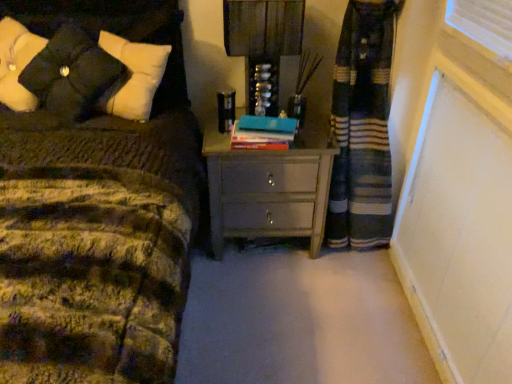
This screenshot has width=512, height=384. I want to click on hardcover book at center, so click(x=263, y=133).

Measure the distance between hardcover book at center and camera.

hardcover book at center is 1.51 meters from camera.

What do you see at coordinates (266, 43) in the screenshot? I see `matte black lampshade at upper center` at bounding box center [266, 43].

In order to face matte black lampshade at upper center, should I rotate leftwards or rightwards?

You should rotate right by 0.998 degrees.

Locate an element on the screen. This screenshot has height=384, width=512. black matte pillow at upper left is located at coordinates (71, 74).

Identify the location of matte gray chest of drawers at center. (269, 187).

Find the location of a particular element. Image resolution: width=512 pixels, height=384 pixels. hardcover book at center is located at coordinates (263, 133).

Between black matte pillow at upper left and matte gray chest of drawers at center, which one has larger width?

matte gray chest of drawers at center is wider.

Find the location of `chest of drawers below the black matte pillow at upper left (from a real-world perspective)`. chest of drawers below the black matte pillow at upper left (from a real-world perspective) is located at coordinates (269, 187).

Is black matte pillow at upper left not close to matte gray chest of drawers at center?

black matte pillow at upper left is near matte gray chest of drawers at center, not far away.

Can matte gray chest of drawers at center be found inside black matte pillow at upper left?

No.

Which object is wider, hardcover book at center or black matte pillow at upper left?

With larger width is black matte pillow at upper left.

The image size is (512, 384). I want to click on pillow that is above the hardcover book at center (from the image's perspective), so click(71, 74).

Between hardcover book at center and black matte pillow at upper left, which one has more height?

Standing taller between the two is black matte pillow at upper left.

From a real-world perspective, does hardcover book at center stand above black matte pillow at upper left?

No.

The height and width of the screenshot is (384, 512). Identify the location of chest of drawers behind the black matte pillow at upper left. tap(269, 187).

Is black matte pillow at upper left surrounded by matte gray chest of drawers at center?

That's incorrect, black matte pillow at upper left is not inside matte gray chest of drawers at center.

How many degrees apart are the facing directions of matte gray chest of drawers at center and black matte pillow at upper left?

There is a 6.2-degree angle between the facing directions of matte gray chest of drawers at center and black matte pillow at upper left.

From the image's perspective, is matte gray chest of drawers at center on top of black matte pillow at upper left?

No, from the image's perspective, matte gray chest of drawers at center is not on top of black matte pillow at upper left.

Considering the sizes of objects matte black lampshade at upper center and hardcover book at center in the image provided, who is bigger, matte black lampshade at upper center or hardcover book at center?

matte black lampshade at upper center is bigger.

From the image's perspective, is matte black lampshade at upper center on hardcover book at center?

Yes.

Which is more to the right, matte black lampshade at upper center or hardcover book at center?

hardcover book at center is more to the right.

Would you consider matte black lampshade at upper center to be distant from hardcover book at center?

That's not correct — matte black lampshade at upper center is a little close to hardcover book at center.

What's the angular difference between matte black lampshade at upper center and matte gray chest of drawers at center's facing directions?

5.24 degrees separate the facing orientations of matte black lampshade at upper center and matte gray chest of drawers at center.

Based on the photo, which of these two, matte black lampshade at upper center or matte gray chest of drawers at center, stands taller?

matte gray chest of drawers at center is taller.

Which object is positioned more to the left, matte black lampshade at upper center or matte gray chest of drawers at center?

matte black lampshade at upper center.

Where is `the chest of drawers that is below the matte black lampshade at upper center (from the image's perspective)`? This screenshot has width=512, height=384. the chest of drawers that is below the matte black lampshade at upper center (from the image's perspective) is located at coordinates (269, 187).

From a real-world perspective, between matte gray chest of drawers at center and hardcover book at center, who is vertically lower?

matte gray chest of drawers at center.

Can you confirm if matte gray chest of drawers at center is smaller than hardcover book at center?

Actually, matte gray chest of drawers at center might be larger than hardcover book at center.

Based on the photo, from the image's perspective, is matte gray chest of drawers at center under hardcover book at center?

Indeed, from the image's perspective, matte gray chest of drawers at center is shown beneath hardcover book at center.

Between matte gray chest of drawers at center and hardcover book at center, which one is positioned in front?

hardcover book at center is in front.

Are hardcover book at center and matte black lampshade at upper center far apart?

hardcover book at center is near matte black lampshade at upper center, not far away.

Measure the distance from hardcover book at center to matte black lampshade at upper center.

hardcover book at center is 10.70 inches from matte black lampshade at upper center.

Is the position of hardcover book at center less distant than that of matte black lampshade at upper center?

No, it is behind matte black lampshade at upper center.

Where is `chest of drawers behind the black matte pillow at upper left`? The width and height of the screenshot is (512, 384). chest of drawers behind the black matte pillow at upper left is located at coordinates (269, 187).

The image size is (512, 384). Find the location of `pillow in front of the hardcover book at center`. pillow in front of the hardcover book at center is located at coordinates (71, 74).

Which object lies further to the anchor point matte black lampshade at upper center, hardcover book at center or black matte pillow at upper left?

black matte pillow at upper left is further to matte black lampshade at upper center.

Considering their positions, is hardcover book at center positioned further to matte black lampshade at upper center than matte gray chest of drawers at center?

Based on the image, matte gray chest of drawers at center appears to be further to matte black lampshade at upper center.

When comparing their distances from hardcover book at center, does matte gray chest of drawers at center or matte black lampshade at upper center seem further?

matte black lampshade at upper center is positioned further to the anchor hardcover book at center.

When comparing their distances from black matte pillow at upper left, does matte gray chest of drawers at center or hardcover book at center seem closer?

The object closer to black matte pillow at upper left is hardcover book at center.

From the image, which object appears to be farther from matte gray chest of drawers at center, matte black lampshade at upper center or black matte pillow at upper left?

The object further to matte gray chest of drawers at center is black matte pillow at upper left.

Based on their spatial positions, is matte black lampshade at upper center or hardcover book at center closer to matte gray chest of drawers at center?

The object closer to matte gray chest of drawers at center is hardcover book at center.

Which object lies nearer to the anchor point hardcover book at center, matte black lampshade at upper center or matte gray chest of drawers at center?

matte gray chest of drawers at center is closer to hardcover book at center.

From the image, which object appears to be farther from hardcover book at center, matte gray chest of drawers at center or black matte pillow at upper left?

black matte pillow at upper left lies further to hardcover book at center than the other object.

The width and height of the screenshot is (512, 384). What are the coordinates of `bedside lamp between black matte pillow at upper left and hardcover book at center` in the screenshot? It's located at click(266, 43).

The image size is (512, 384). I want to click on bedside lamp located between black matte pillow at upper left and matte gray chest of drawers at center in the left-right direction, so click(x=266, y=43).

Locate an element on the screen. This screenshot has height=384, width=512. book between black matte pillow at upper left and matte gray chest of drawers at center in the horizontal direction is located at coordinates (263, 133).

Where is `book between matte black lampshade at upper center and matte gray chest of drawers at center in the up-down direction`? This screenshot has width=512, height=384. book between matte black lampshade at upper center and matte gray chest of drawers at center in the up-down direction is located at coordinates (263, 133).